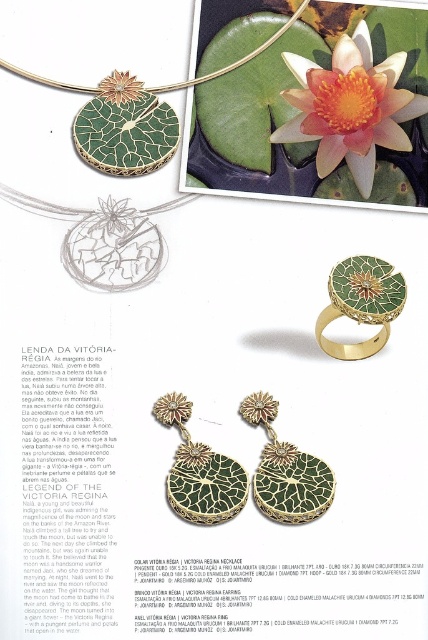
Question: Which object is closer to the camera taking this photo?

Choices:
 (A) green mosaic pendant at center
 (B) green mosaic earrings at center

Answer: (B)

Question: From the image, what is the correct spatial relationship of orange lily pad at upper center in relation to green mosaic earrings at center?

Choices:
 (A) below
 (B) above

Answer: (B)

Question: Can you confirm if orange lily pad at upper center is wider than green mosaic earrings at center?

Choices:
 (A) yes
 (B) no

Answer: (A)

Question: Based on their relative distances, which object is farther from the orange lily pad at upper center?

Choices:
 (A) green mosaic earrings at center
 (B) green mosaic pendant at center

Answer: (B)

Question: From the image, what is the correct spatial relationship of green mosaic pendant at center in relation to green mosaic earrings at center?

Choices:
 (A) left
 (B) right

Answer: (A)

Question: Estimate the real-world distances between objects in this image. Which object is closer to the green mosaic ring at center?

Choices:
 (A) green mosaic earrings at center
 (B) green mosaic pendant at center
 (C) orange lily pad at upper center

Answer: (A)